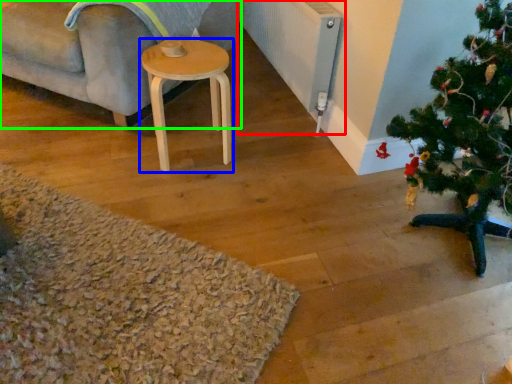
Question: Considering the real-world distances, which object is closest to radiator (highlighted by a red box)? stool (highlighted by a blue box) or studio couch (highlighted by a green box).

Choices:
 (A) stool
 (B) studio couch

Answer: (A)